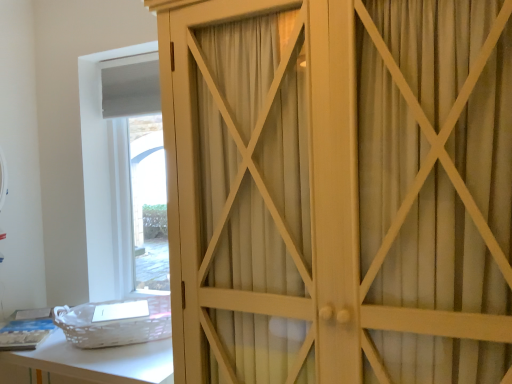
Question: Considering the relative sizes of white wicker basket at lower left and white wood cupboard at center in the image provided, is white wicker basket at lower left bigger than white wood cupboard at center?

Choices:
 (A) yes
 (B) no

Answer: (B)

Question: Is the depth of white wicker basket at lower left greater than that of white wood cupboard at center?

Choices:
 (A) yes
 (B) no

Answer: (A)

Question: Is white wicker basket at lower left directly adjacent to white wood cupboard at center?

Choices:
 (A) no
 (B) yes

Answer: (A)

Question: From the image's perspective, would you say white wicker basket at lower left is shown under white wood cupboard at center?

Choices:
 (A) no
 (B) yes

Answer: (B)

Question: Considering the relative positions of white wicker basket at lower left and white wood cupboard at center in the image provided, is white wicker basket at lower left to the right of white wood cupboard at center from the viewer's perspective?

Choices:
 (A) yes
 (B) no

Answer: (B)

Question: Does white wicker basket at lower left have a lesser width compared to white wood cupboard at center?

Choices:
 (A) no
 (B) yes

Answer: (B)

Question: Is white wood cupboard at center far away from white wicker basket at lower left?

Choices:
 (A) no
 (B) yes

Answer: (A)

Question: From a real-world perspective, is white wood cupboard at center located higher than white wicker basket at lower left?

Choices:
 (A) yes
 (B) no

Answer: (A)

Question: Could you tell me if white wood cupboard at center is facing white wicker basket at lower left?

Choices:
 (A) yes
 (B) no

Answer: (B)

Question: Considering the relative positions of white wood cupboard at center and white wicker basket at lower left in the image provided, is white wood cupboard at center to the right of white wicker basket at lower left from the viewer's perspective?

Choices:
 (A) no
 (B) yes

Answer: (B)

Question: Is white wood cupboard at center positioned with its back to white wicker basket at lower left?

Choices:
 (A) yes
 (B) no

Answer: (B)

Question: From the image's perspective, would you say white wood cupboard at center is positioned over white wicker basket at lower left?

Choices:
 (A) no
 (B) yes

Answer: (B)

Question: Is point (135, 365) closer or farther from the camera than point (233, 114)?

Choices:
 (A) farther
 (B) closer

Answer: (A)